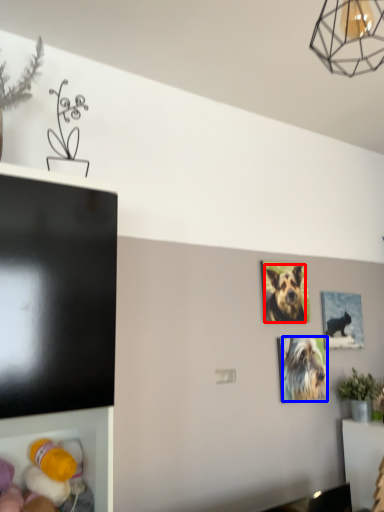
Question: Among these objects, which one is nearest to the camera, dog (highlighted by a red box) or dog (highlighted by a blue box)?

Choices:
 (A) dog
 (B) dog

Answer: (B)